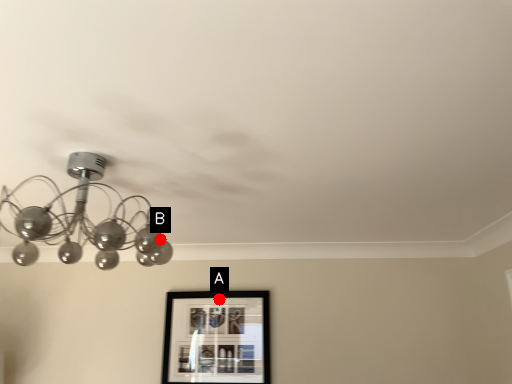
Question: Two points are circled on the image, labeled by A and B beside each circle. Which of the following is the farthest from the observer?

Choices:
 (A) A is further
 (B) B is further

Answer: (A)